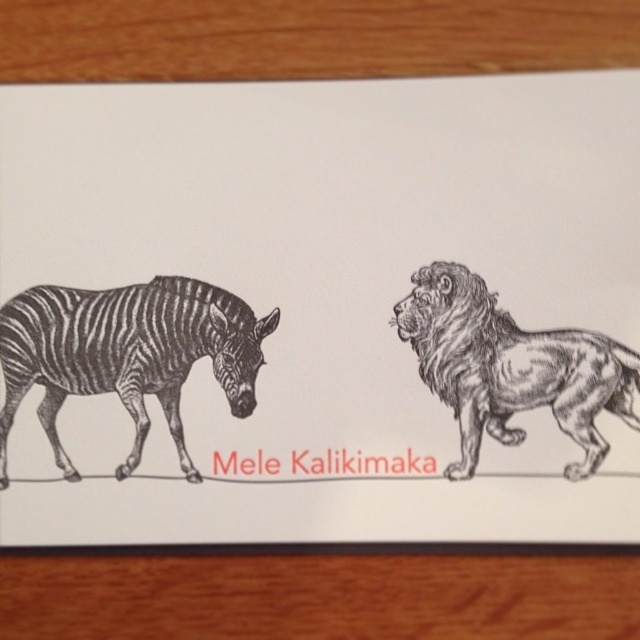
Does point (184, 474) come behind point (461, 353)?

No, it is not.

Which is more to the right, black and white striped zebra at left or black ink lion at right?

black ink lion at right

Which is in front, point (20, 292) or point (492, 380)?

Point (492, 380) is in front.

What are the coordinates of `black and white striped zebra at left` in the screenshot? It's located at (125, 353).